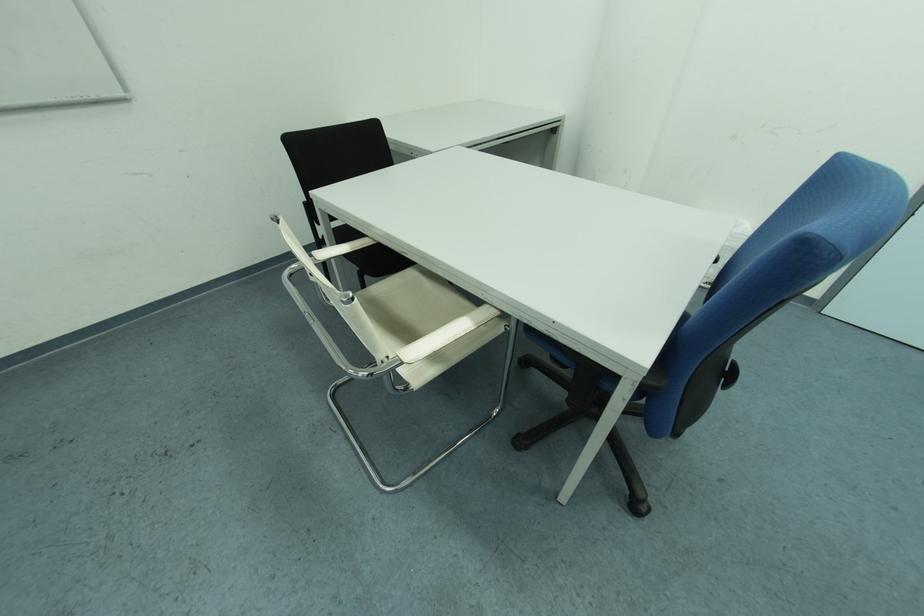
Identify the location of white chair sitting surface. The image size is (924, 616). (419, 312).